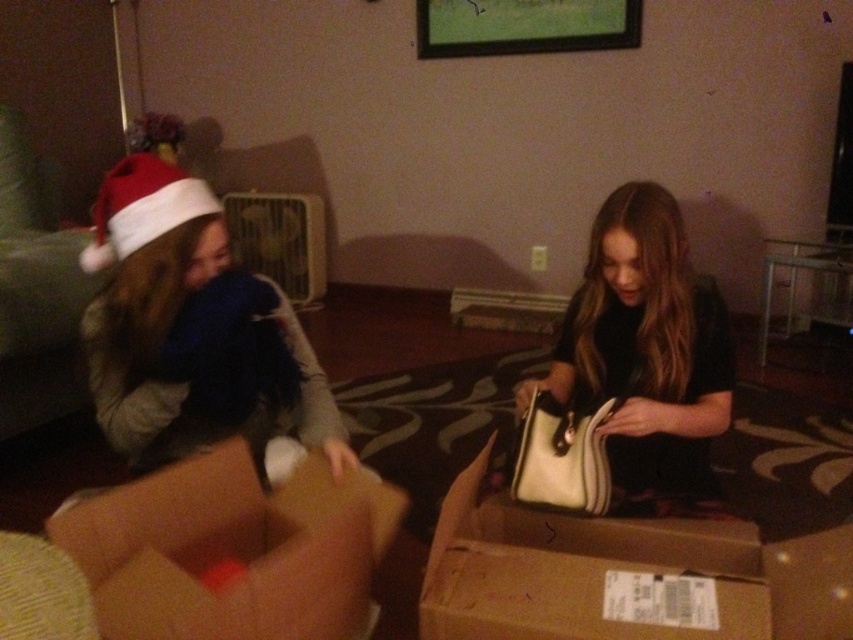
Question: Which object is positioned farthest from the red velvet santa hat at upper left?

Choices:
 (A) brown cardboard box at lower right
 (B) white leather purse at center
 (C) brown cardboard box at lower left
 (D) matte white plush at left

Answer: (A)

Question: Does brown cardboard box at lower right have a lesser width compared to white leather purse at center?

Choices:
 (A) yes
 (B) no

Answer: (B)

Question: Among these points, which one is farthest from the camera?

Choices:
 (A) (289, 374)
 (B) (146, 564)

Answer: (A)

Question: Which object is the farthest from the brown cardboard box at lower right?

Choices:
 (A) red velvet santa hat at upper left
 (B) brown cardboard box at lower left

Answer: (A)

Question: Can you confirm if brown cardboard box at lower left is positioned below red velvet santa hat at upper left?

Choices:
 (A) yes
 (B) no

Answer: (A)

Question: Does matte white plush at left appear on the left side of red velvet santa hat at upper left?

Choices:
 (A) yes
 (B) no

Answer: (B)